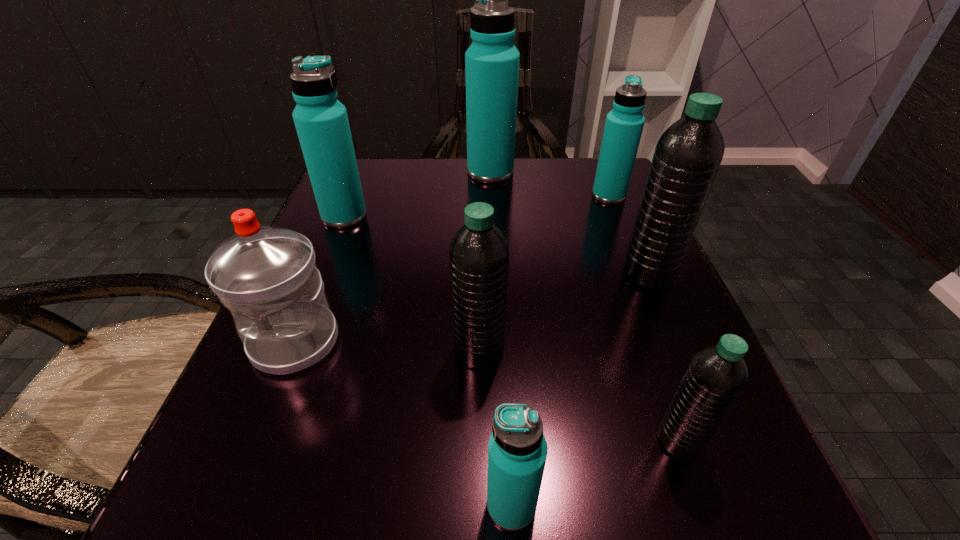
Identify the location of the biggest blue water bottle. (492, 61).

The height and width of the screenshot is (540, 960). I want to click on the tallest water bottle, so click(x=492, y=61).

Identify the location of the leftmost blue water bottle. This screenshot has height=540, width=960. (321, 121).

You are a GUI agent. You are given a task and a screenshot of the screen. Output one action in this format:
    pyautogui.click(x=<x>, y=<y>)
    Task: Click on the fifth nearest water bottle
    This screenshot has width=960, height=540.
    Given the screenshot: What is the action you would take?
    click(688, 154)

This screenshot has width=960, height=540. Identify the location of the fourth farthest object. (688, 154).

Locate an element on the screen. the third biggest blue water bottle is located at coordinates (624, 124).

Where is `the second smallest black water bottle`? Image resolution: width=960 pixels, height=540 pixels. the second smallest black water bottle is located at coordinates (479, 253).

Find the location of a particular element. This screenshot has height=540, width=960. the leftmost black water bottle is located at coordinates (479, 253).

This screenshot has height=540, width=960. In order to click on white water bottle in this screenshot , I will do `click(267, 276)`.

Locate an element on the screen. the smallest black water bottle is located at coordinates (716, 376).